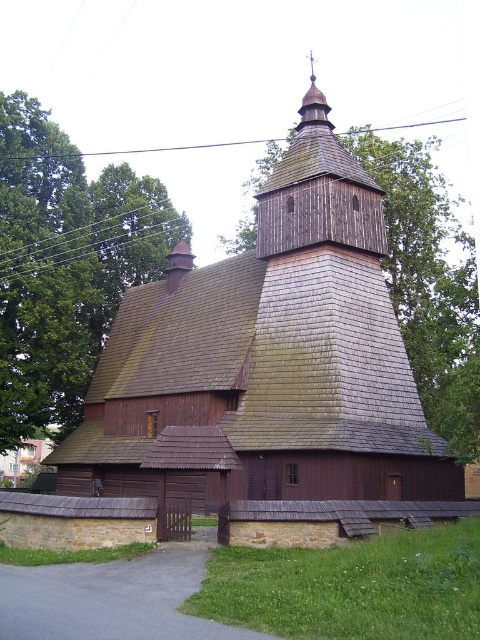
You are standing in front of the church and notice a green leafy tree at upper left and a wooden spire at upper center. Which one is taller?

The green leafy tree at upper left is not as tall as the wooden spire at upper center, so the wooden spire at upper center is taller.

You are standing in front of the church and want to take a photo of the dark brown wooden church at center and the brown wooden roof at upper center. Which object will appear larger in your photo?

The dark brown wooden church at center will appear larger in the photo because it is closer to the viewer than the brown wooden roof at upper center.

You are standing in front of the church and want to take a photo that includes both the green leafy tree at upper left and the wooden spire at upper center. Which object should you position closer to the front of your photo?

You should position the green leafy tree at upper left closer to the front of your photo because it is closer to you than the wooden spire at upper center.